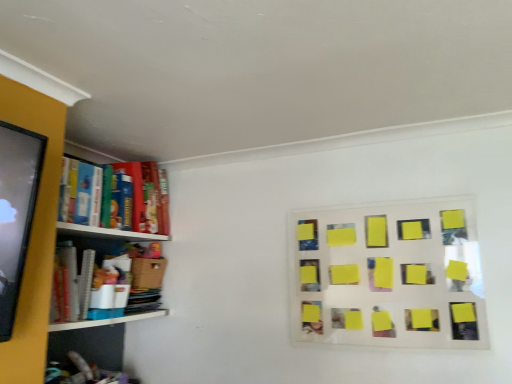
Question: Is yellow sticky notes at upper right thinner than matte cardboard bookshelf at left?

Choices:
 (A) no
 (B) yes

Answer: (B)

Question: Does yellow sticky notes at upper right have a lesser height compared to matte cardboard bookshelf at left?

Choices:
 (A) no
 (B) yes

Answer: (A)

Question: From the image's perspective, is yellow sticky notes at upper right over matte cardboard bookshelf at left?

Choices:
 (A) yes
 (B) no

Answer: (B)

Question: Would you say yellow sticky notes at upper right is outside matte cardboard bookshelf at left?

Choices:
 (A) no
 (B) yes

Answer: (B)

Question: Can you confirm if yellow sticky notes at upper right is positioned to the right of matte cardboard bookshelf at left?

Choices:
 (A) no
 (B) yes

Answer: (B)

Question: Does yellow sticky notes at upper right turn towards matte cardboard bookshelf at left?

Choices:
 (A) no
 (B) yes

Answer: (A)

Question: Considering the relative sizes of matte cardboard bookshelf at left and yellow sticky notes at upper right in the image provided, is matte cardboard bookshelf at left shorter than yellow sticky notes at upper right?

Choices:
 (A) no
 (B) yes

Answer: (B)

Question: From the image's perspective, is matte cardboard bookshelf at left beneath yellow sticky notes at upper right?

Choices:
 (A) yes
 (B) no

Answer: (B)

Question: Is matte cardboard bookshelf at left to the right of yellow sticky notes at upper right from the viewer's perspective?

Choices:
 (A) yes
 (B) no

Answer: (B)

Question: Is the depth of matte cardboard bookshelf at left less than that of yellow sticky notes at upper right?

Choices:
 (A) yes
 (B) no

Answer: (B)

Question: Is yellow sticky notes at upper right located within matte cardboard bookshelf at left?

Choices:
 (A) yes
 (B) no

Answer: (B)

Question: Is matte cardboard bookshelf at left to the left of yellow sticky notes at upper right from the viewer's perspective?

Choices:
 (A) yes
 (B) no

Answer: (A)

Question: In terms of height, does matte cardboard bookshelf at left look taller or shorter compared to yellow sticky notes at upper right?

Choices:
 (A) tall
 (B) short

Answer: (B)